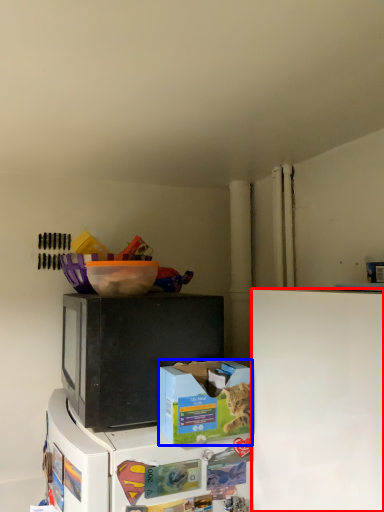
Question: Among these objects, which one is nearest to the camera, refrigerator (highlighted by a red box) or box (highlighted by a blue box)?

Choices:
 (A) refrigerator
 (B) box

Answer: (A)